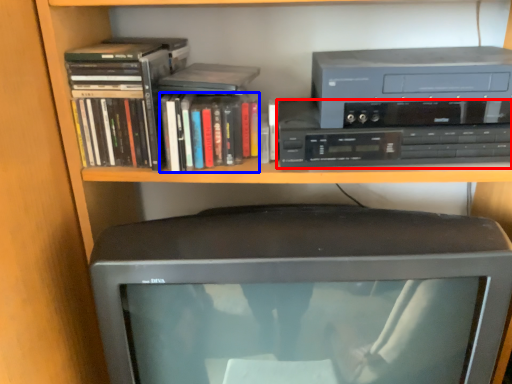
Question: Which point is closer to the camera, cassette (highlighted by a red box) or book (highlighted by a blue box)?

Choices:
 (A) cassette
 (B) book

Answer: (A)